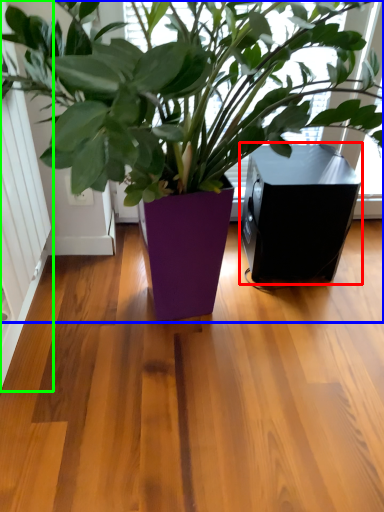
Question: Which object is the closest to the speaker (highlighted by a red box)? Choose among these: houseplant (highlighted by a blue box) or screen door (highlighted by a green box).

Choices:
 (A) houseplant
 (B) screen door

Answer: (A)